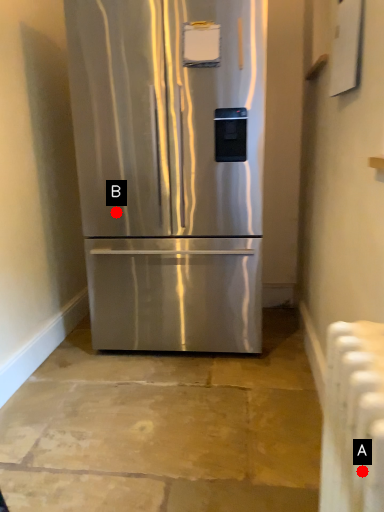
Question: Two points are circled on the image, labeled by A and B beside each circle. Which point appears farthest from the camera in this image?

Choices:
 (A) A is further
 (B) B is further

Answer: (B)